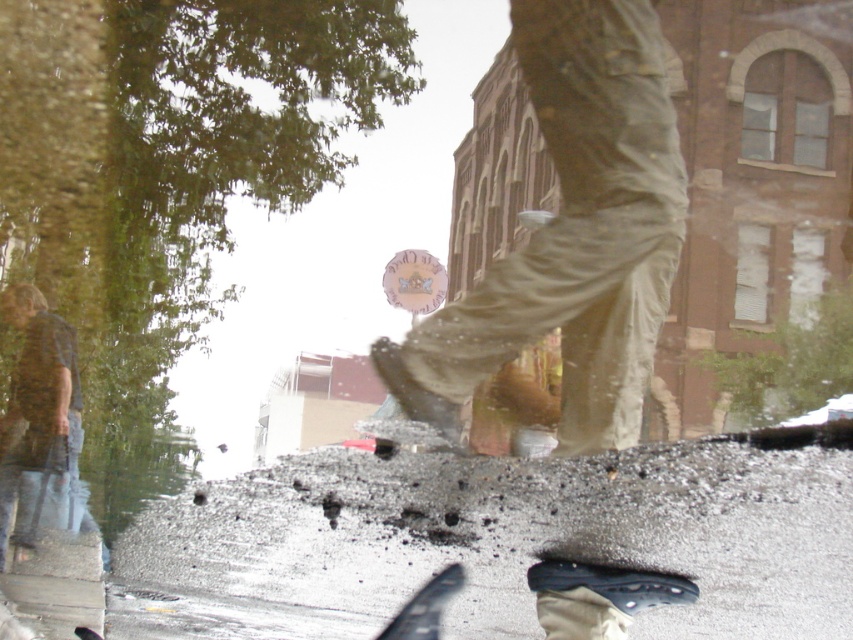
You are a photographer trying to capture both the khaki pants at center and the denim jeans at left in a single frame. Based on their sizes, which one should you adjust your camera focus to prioritize for clarity?

The khaki pants at center is larger in size than the denim jeans at left, so you should prioritize focusing on the khaki pants at center for clarity since it occupies more of the frame.

You are standing at the point with coordinates point [595,156] and want to walk towards the point with coordinates point [74,435]. Which direction should you face to walk directly towards it?

Since point [595,156] is in front of point 0.681, 089, you should face downward to walk directly towards it.

You are a delivery robot positioned at the start of the street. Your destination is the large older building with arched windows. Which direction should you head towards to reach it, considering the dark gray asphalt at lower center is your current path?

The dark gray asphalt at lower center is located at point [498,540], which suggests it is positioned towards the lower part of the image. Since the building is in the background, you should move forward along the dark gray asphalt at lower center towards the building in the back to reach your destination.